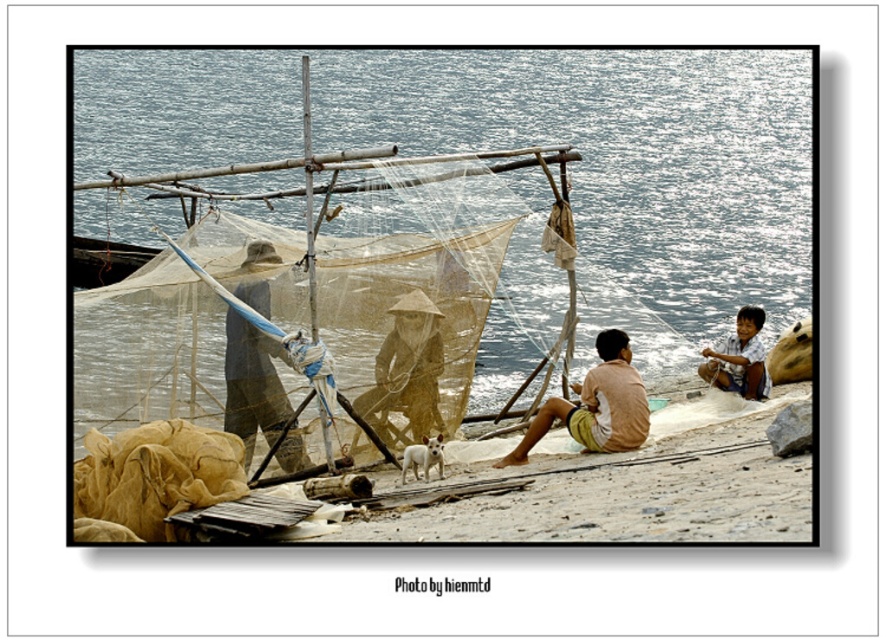
Question: Is brown woven hat at center smaller than light brown woven shorts at center?

Choices:
 (A) no
 (B) yes

Answer: (A)

Question: Which object is the closest to the brown woven hat at center?

Choices:
 (A) matte blue fishing net at center
 (B) light brown wooden stick at lower right
 (C) light brown woven shorts at center
 (D) blue water at upper center

Answer: (A)

Question: Is blue water at upper center thinner than matte blue fishing net at center?

Choices:
 (A) yes
 (B) no

Answer: (B)

Question: Which point is farther from the camera taking this photo?

Choices:
 (A) (628, 378)
 (B) (408, 381)
 (C) (294, 424)
 (D) (650, 138)

Answer: (D)

Question: Which object appears farthest from the camera in this image?

Choices:
 (A) blue water at upper center
 (B) matte blue fishing net at center

Answer: (B)

Question: Is blue water at upper center below brown woven hat at center?

Choices:
 (A) yes
 (B) no

Answer: (B)